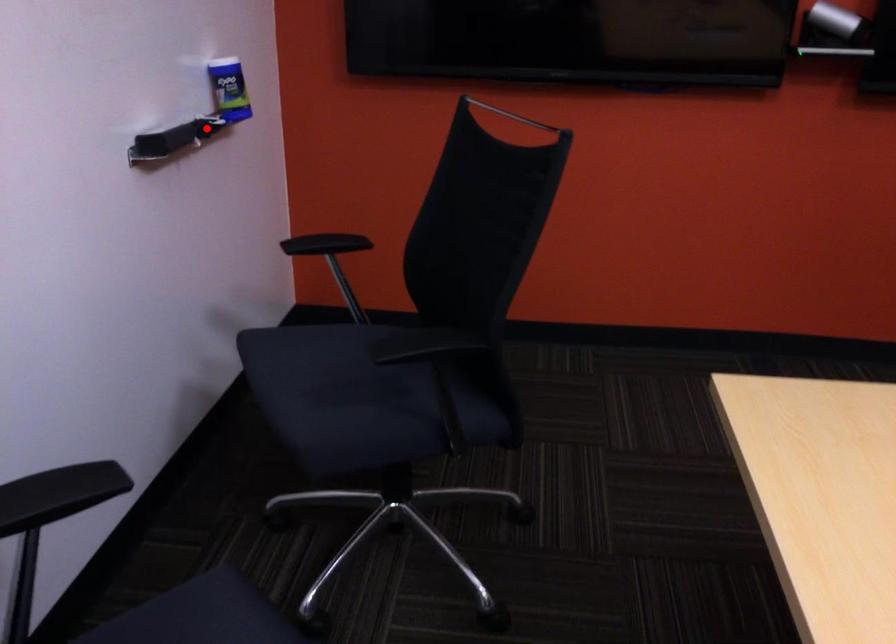
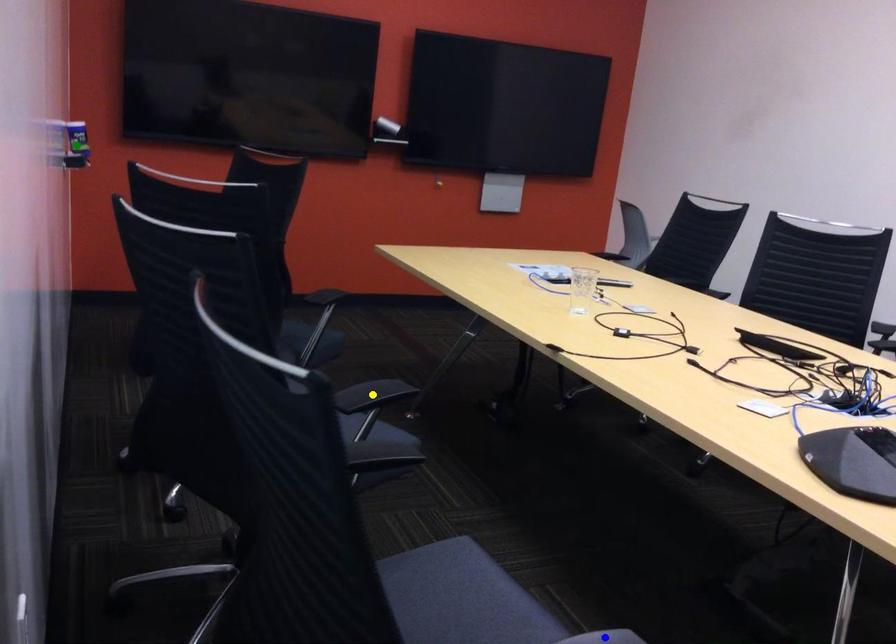
Question: I am providing you with two images of the same scene from different viewpoints. A red point is marked on the first image. You are given multiple points on the second image. Can you choose the point in image 2 that corresponds to the point in image 1?

Choices:
 (A) yellow point
 (B) green point
 (C) blue point

Answer: (B)